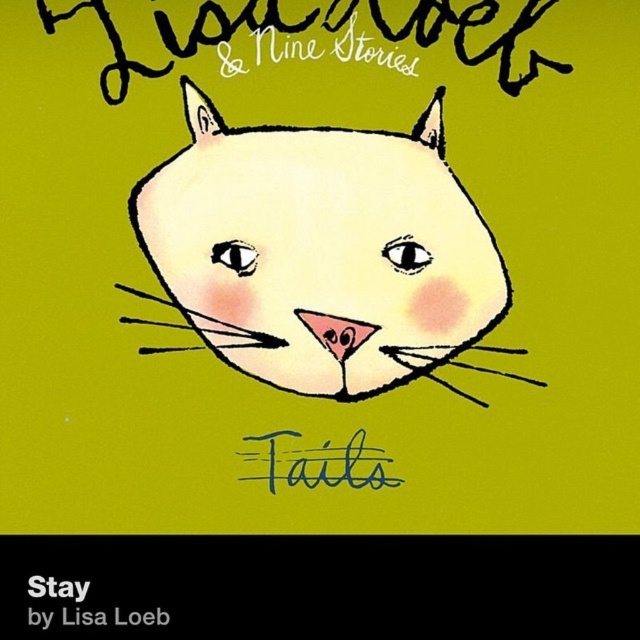
Does matte white cat at center have a greater width compared to blue handwritten text at center?

Correct, the width of matte white cat at center exceeds that of blue handwritten text at center.

Does matte white cat at center appear on the left side of blue handwritten text at center?

In fact, matte white cat at center is to the right of blue handwritten text at center.

Locate an element on the screen. matte white cat at center is located at coordinates (321, 252).

Who is positioned more to the right, matte white cat at center or handwritten ink text at upper center?

matte white cat at center

Is point (493, 252) positioned in front of point (465, 33)?

No, it is not.

Find the location of `matte white cat at center`. matte white cat at center is located at coordinates coord(321,252).

This screenshot has width=640, height=640. Identify the location of matte white cat at center. 321,252.

Does handwritten ink text at upper center have a smaller size compared to blue handwritten text at center?

No.

Between handwritten ink text at upper center and blue handwritten text at center, which one appears on the left side from the viewer's perspective?

handwritten ink text at upper center is more to the left.

Does point (216, 10) come closer to viewer compared to point (273, 460)?

Yes, it is.

Where is `handwritten ink text at upper center`? The image size is (640, 640). handwritten ink text at upper center is located at coordinates (472, 35).